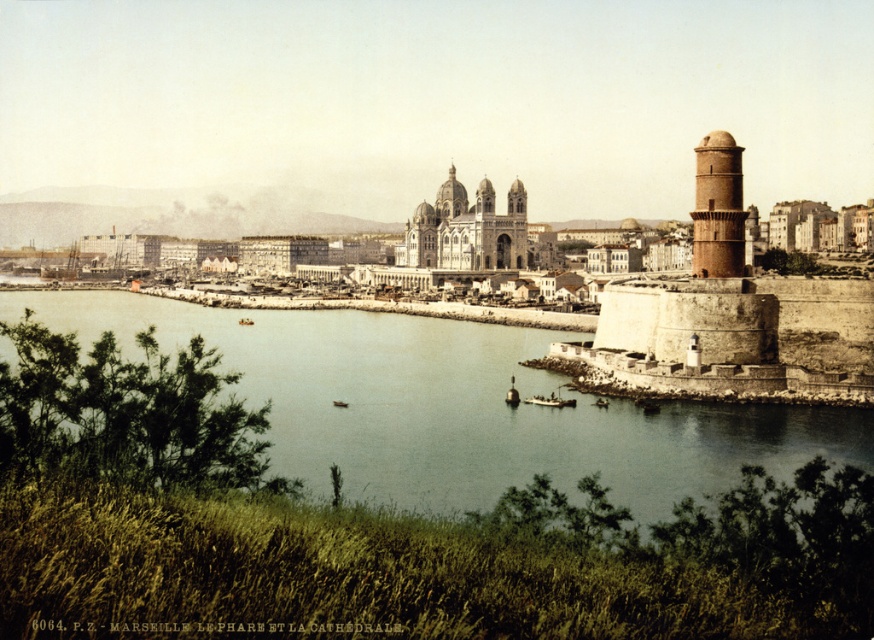
You are a tourist planning to take a photo of the white stone fort at center and the brown textured tower at right from a distance. Based on their sizes, which one would appear bigger in your camera view?

The white stone fort at center appears bigger in the camera view because it is larger in size than the brown textured tower at right.

You are a tourist in Marseille and want to take a photo of the Phare de la Ciotat and the Basilica of Notre Dame de la Garde. You are standing at the point marked by the coordinates point (454, 406). Can you see both landmarks clearly from this position?

The point (454, 406) indicates greenish water at center, so you are standing in the water. Since you are in the water, you cannot take a clear photo of the landmarks from this position.